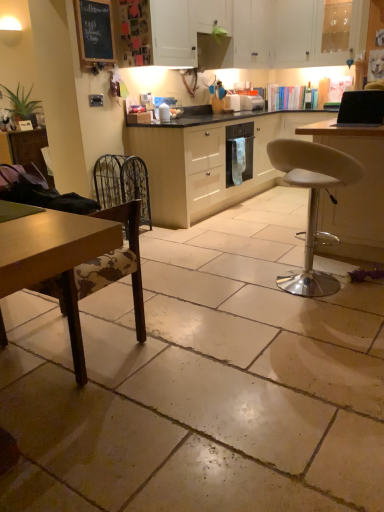
Where is `vacant space to the left of white leather stool at center-right, which is the first chair from right to left`? This screenshot has height=512, width=384. vacant space to the left of white leather stool at center-right, which is the first chair from right to left is located at coordinates (229, 291).